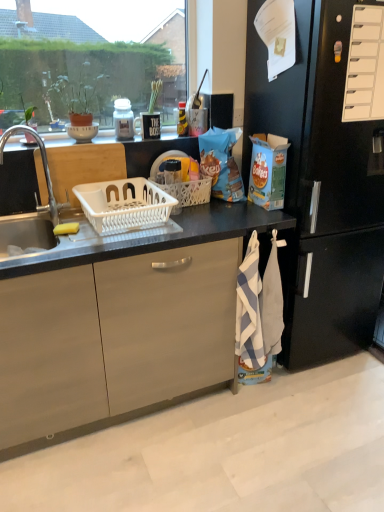
Identify the location of black matte refrigerator at right. (322, 187).

Measure the distance between wooden cutting board at upper center and camera.

They are 5.94 feet apart.

What do you see at coordinates (190, 191) in the screenshot? I see `white plastic basket at center, marked as the 1th picnic basket in a right-to-left arrangement` at bounding box center [190, 191].

What is the approximate width of white plastic basket at center, marked as the second picnic basket in a left-to-right arrangement?

8.58 inches.

Describe the element at coordinates (80, 96) in the screenshot. The height and width of the screenshot is (512, 384). I see `green leafy plant at upper left` at that location.

Locate an element on the screen. This screenshot has height=512, width=384. black matte refrigerator at right is located at coordinates (322, 187).

Could you tell me if green leafy plant at upper left is turned towards silver metallic sink at left?

No, green leafy plant at upper left is not oriented towards silver metallic sink at left.

Can you confirm if green leafy plant at upper left is shorter than silver metallic sink at left?

Correct, green leafy plant at upper left is not as tall as silver metallic sink at left.

Find the location of `sink below the green leafy plant at upper left (from the image's perspective)`. sink below the green leafy plant at upper left (from the image's perspective) is located at coordinates (36, 209).

Is point (96, 85) farther from camera compared to point (37, 218)?

Yes, point (96, 85) is behind point (37, 218).

Consider the image. Is yellow sponge at sink left surrounding wooden cutting board at upper center?

No, wooden cutting board at upper center is located outside of yellow sponge at sink left.

Is yellow sponge at sink left aimed at wooden cutting board at upper center?

No, yellow sponge at sink left is not oriented towards wooden cutting board at upper center.

Considering the points (67, 229) and (153, 143), which point is behind, point (67, 229) or point (153, 143)?

The point (153, 143) is farther from the camera.

Considering the sizes of objects yellow sponge at sink left and wooden cutting board at upper center in the image provided, who is taller, yellow sponge at sink left or wooden cutting board at upper center?

wooden cutting board at upper center is taller.

From a real-world perspective, is wooden cutting board at upper center positioned above or below green leafy plant at upper left?

From a real-world perspective, wooden cutting board at upper center is physically below green leafy plant at upper left.

Would you consider wooden cutting board at upper center to be distant from green leafy plant at upper left?

No, wooden cutting board at upper center is in close proximity to green leafy plant at upper left.

Which of these two, wooden cutting board at upper center or green leafy plant at upper left, is bigger?

With larger size is green leafy plant at upper left.

Can you confirm if wooden cutting board at upper center is positioned to the left of yellow sponge at sink left?

No.

Is point (111, 133) closer or farther from the camera than point (72, 226)?

Clearly, point (111, 133) is more distant from the camera than point (72, 226).

Is wooden cutting board at upper center positioned far away from yellow sponge at sink left?

No, wooden cutting board at upper center is in close proximity to yellow sponge at sink left.

From the image's perspective, between wooden cutting board at upper center and yellow sponge at sink left, which one is located above?

wooden cutting board at upper center.

From the image's perspective, which is below, wooden cutting board at upper center or blue striped towel at lower right?

blue striped towel at lower right is shown below in the image.

Considering the sizes of wooden cutting board at upper center and blue striped towel at lower right in the image, is wooden cutting board at upper center taller or shorter than blue striped towel at lower right?

In the image, wooden cutting board at upper center appears to be shorter than blue striped towel at lower right.

How distant is wooden cutting board at upper center from blue striped towel at lower right?

wooden cutting board at upper center is 34.53 inches away from blue striped towel at lower right.

Does point (125, 142) come behind point (244, 327)?

That is True.

Which is behind, point (177, 92) or point (76, 125)?

The point (177, 92) is behind.

From the picture: Is clear glass window at upper left bigger or smaller than green leafy plant at upper left?

Considering their sizes, clear glass window at upper left takes up more space than green leafy plant at upper left.

Is clear glass window at upper left shorter than green leafy plant at upper left?

No.

From a real-world perspective, which is physically above, clear glass window at upper left or green leafy plant at upper left?

clear glass window at upper left.

From a real-world perspective, who is located lower, yellow sponge at sink left or blue striped towel at lower right?

In real-world perspective, blue striped towel at lower right is lower.

Is yellow sponge at sink left at the left side of blue striped towel at lower right?

Indeed, yellow sponge at sink left is positioned on the left side of blue striped towel at lower right.

Does yellow sponge at sink left touch blue striped towel at lower right?

No, yellow sponge at sink left is not with blue striped towel at lower right.

Considering the sizes of yellow sponge at sink left and blue striped towel at lower right in the image, is yellow sponge at sink left taller or shorter than blue striped towel at lower right?

Clearly, yellow sponge at sink left is shorter compared to blue striped towel at lower right.

In the image, there is a silver metallic sink at left. Where is `houseplant above it (from the image's perspective)`? houseplant above it (from the image's perspective) is located at coordinates pos(80,96).

Locate an element on the screen. Image resolution: width=384 pixels, height=512 pixels. window sill that appears above the yellow sponge at sink left (from a real-world perspective) is located at coordinates (146, 140).

From the picture: Estimate the real-world distances between objects in this image. Which object is closer to clear glass window at upper left, black matte refrigerator at right or white plastic basket at center, marked as the 1th picnic basket in a right-to-left arrangement?

white plastic basket at center, marked as the 1th picnic basket in a right-to-left arrangement, is closer to clear glass window at upper left.

Looking at the image, which one is located closer to blue striped towel at lower right, black matte refrigerator at right or white plastic basket at sink, which is the 2th picnic basket from right to left?

black matte refrigerator at right lies closer to blue striped towel at lower right than the other object.

From the image, which object appears to be nearer to yellow sponge at sink left, blue striped towel at lower right or black matte refrigerator at right?

blue striped towel at lower right is positioned closer to the anchor yellow sponge at sink left.

From the image, which object appears to be farther from wooden cutting board at upper center, blue striped towel at lower right or white plastic basket at sink, which is the 1th picnic basket from left to right?

Among the two, blue striped towel at lower right is located further to wooden cutting board at upper center.

Considering their positions, is wooden cutting board at upper center positioned closer to blue striped towel at lower right than white plastic basket at center, marked as the second picnic basket in a left-to-right arrangement?

white plastic basket at center, marked as the second picnic basket in a left-to-right arrangement.

Considering their positions, is black matte refrigerator at right positioned further to clear glass window at upper left than silver metallic sink at left?

black matte refrigerator at right is positioned further to the anchor clear glass window at upper left.

Looking at this image, estimate the real-world distances between objects in this image. Which object is closer to yellow sponge at sink left, wooden cutting board at upper center or white plastic basket at center, marked as the 1th picnic basket in a right-to-left arrangement?

white plastic basket at center, marked as the 1th picnic basket in a right-to-left arrangement.

Considering their positions, is white plastic basket at center, marked as the 1th picnic basket in a right-to-left arrangement, positioned further to green leafy plant at upper left than white plastic basket at sink, which is the 1th picnic basket from left to right?

white plastic basket at center, marked as the 1th picnic basket in a right-to-left arrangement, is positioned further to the anchor green leafy plant at upper left.

Identify the location of picnic basket between yellow sponge at sink left and white plastic basket at center, marked as the second picnic basket in a left-to-right arrangement, from left to right. (124, 205).

The image size is (384, 512). I want to click on beach towel located between yellow sponge at sink left and black matte refrigerator at right in the left-right direction, so click(249, 309).

I want to click on window sill that lies between green leafy plant at upper left and yellow sponge at sink left from top to bottom, so [146, 140].

This screenshot has height=512, width=384. What are the coordinates of `houseplant between clear glass window at upper left and silver metallic sink at left in the up-down direction` in the screenshot? It's located at (80, 96).